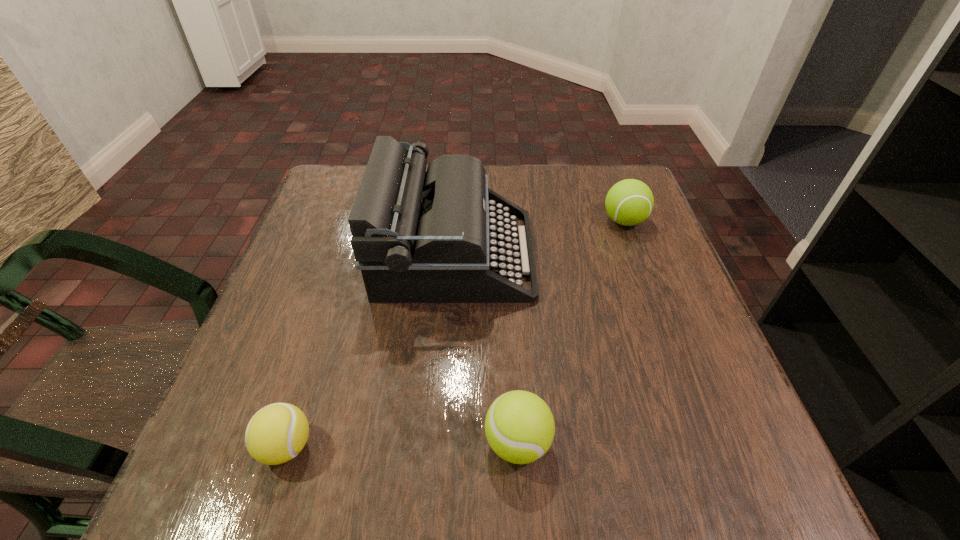
Where is `typewriter`? This screenshot has width=960, height=540. typewriter is located at coordinates (438, 236).

At what (x,y) coordinates should I click in order to perform the action: click on the farthest tennis ball. Please return your answer as a coordinate pair (x, y). Looking at the image, I should click on pos(629,202).

Where is `the rightmost tennis ball`? Image resolution: width=960 pixels, height=540 pixels. the rightmost tennis ball is located at coordinates (629, 202).

Find the location of `the second tennis ball from left to right`. the second tennis ball from left to right is located at coordinates (519, 426).

Where is `the leftmost tennis ball`? the leftmost tennis ball is located at coordinates (277, 433).

The height and width of the screenshot is (540, 960). What are the coordinates of `the shortest object` in the screenshot? It's located at pyautogui.click(x=277, y=433).

Image resolution: width=960 pixels, height=540 pixels. Identify the location of vacant space situated 0.090m on the typing side of the tallest object. (573, 254).

I want to click on blank area located 0.050m on the left of the rightmost tennis ball, so click(x=581, y=221).

Image resolution: width=960 pixels, height=540 pixels. In order to click on vacant position located on the left of the second tennis ball from right to left in this screenshot , I will do `click(445, 442)`.

Locate an element on the screen. The image size is (960, 540). blank area located on the right of the leftmost tennis ball is located at coordinates (407, 446).